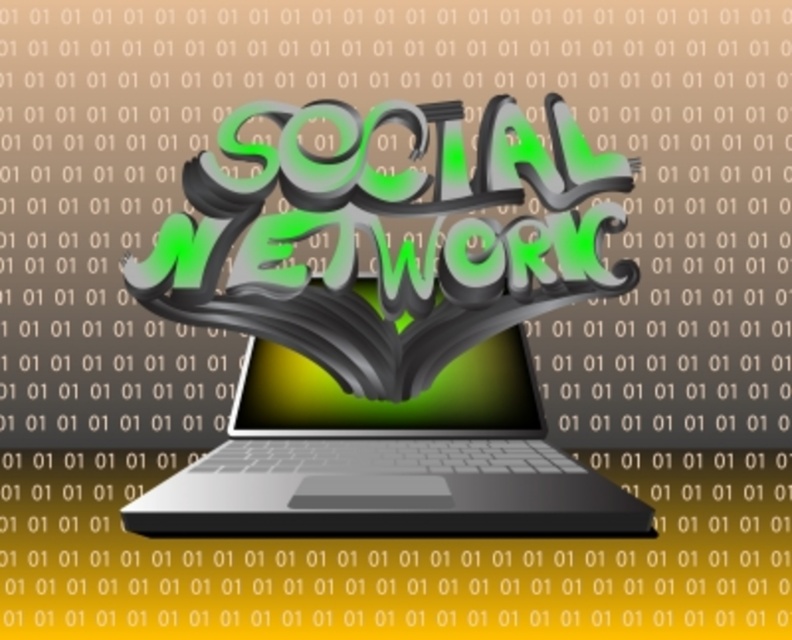
Question: Does satin black laptop at center have a larger size compared to shiny metallic screen at center?

Choices:
 (A) yes
 (B) no

Answer: (A)

Question: Which of the following is the closest to the observer?

Choices:
 (A) (524, 410)
 (B) (297, 404)

Answer: (B)

Question: Does satin black laptop at center appear on the left side of shiny metallic screen at center?

Choices:
 (A) yes
 (B) no

Answer: (B)

Question: In this image, where is satin black laptop at center located relative to shiny metallic screen at center?

Choices:
 (A) left
 (B) right

Answer: (B)